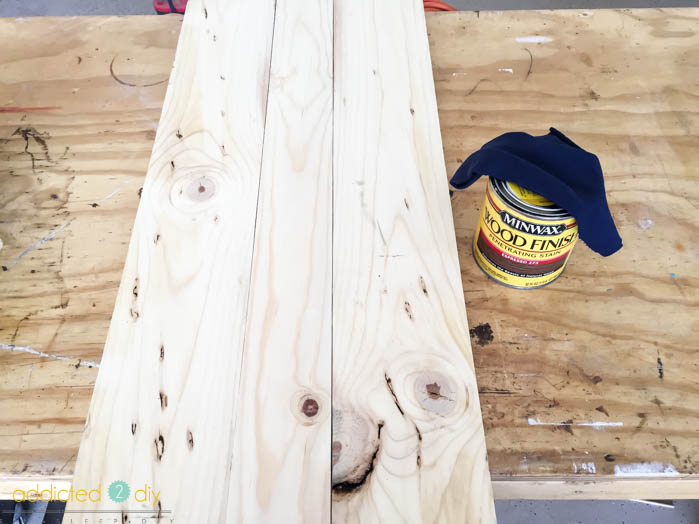
Identify the location of wood plank. (302, 301).